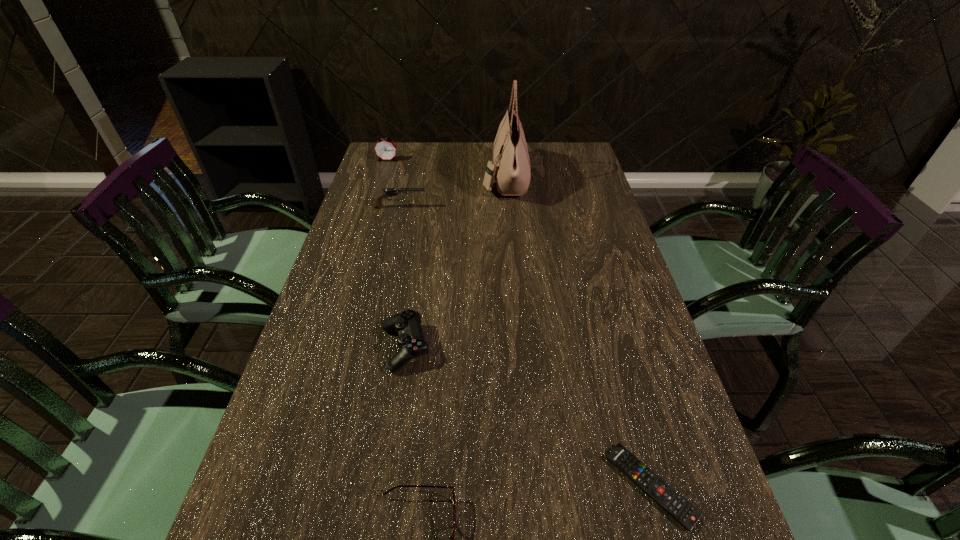
What are the coordinates of `free space at the far edge of the desktop` in the screenshot? It's located at (542, 166).

The image size is (960, 540). In order to click on vacant point at the left edge in this screenshot , I will do `click(331, 274)`.

What are the coordinates of `vacant space at the right edge` in the screenshot? It's located at (630, 297).

Locate an element on the screen. vacant point at the far right corner is located at coordinates (565, 159).

This screenshot has height=540, width=960. I want to click on free space between the handbag and the remote control, so click(578, 333).

You are a GUI agent. You are given a task and a screenshot of the screen. Output one action in this format:
    pyautogui.click(x=<x>, y=<y>)
    Task: Click on the blank region between the control and the alarm clock
    
    Given the screenshot: What is the action you would take?
    pyautogui.click(x=396, y=254)

At what (x,y) coordinates should I click in order to perform the action: click on free space between the second object from right to left and the fifth shortest object. Please return your answer as a coordinate pair (x, y). Image resolution: width=960 pixels, height=540 pixels. Looking at the image, I should click on (446, 169).

The image size is (960, 540). Find the location of `unoccupied position between the control and the fifth object from left to right`. unoccupied position between the control and the fifth object from left to right is located at coordinates (455, 264).

This screenshot has height=540, width=960. What are the coordinates of `vacant space that is in between the handbag and the alarm clock` in the screenshot? It's located at (446, 169).

At what (x,y) coordinates should I click in order to perform the action: click on free space that is in between the handbag and the gun. Please return your answer as a coordinate pair (x, y). This screenshot has height=540, width=960. Looking at the image, I should click on (453, 193).